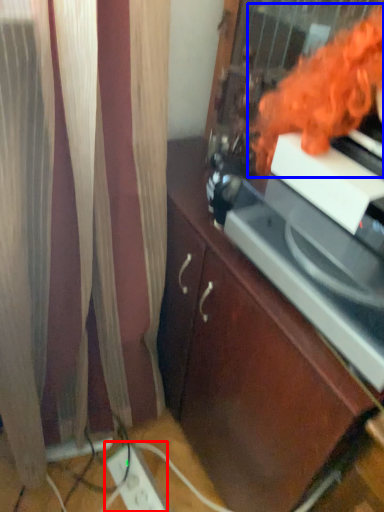
Question: Which object appears closest to the camera in this image, extension cord (highlighted by a red box) or woman (highlighted by a blue box)?

Choices:
 (A) extension cord
 (B) woman

Answer: (B)